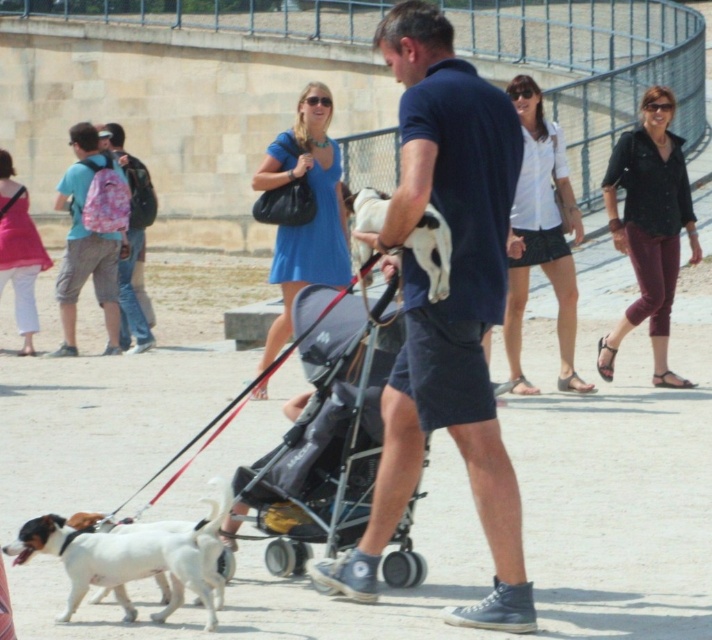
Question: Which object is closer to the camera taking this photo?

Choices:
 (A) dark blue cotton polo shirt at center
 (B) pink backpack at left
 (C) white fur dog at lower left

Answer: (A)

Question: Which point appears farthest from the camera in this image?

Choices:
 (A) (127, 333)
 (B) (325, 371)
 (C) (498, 477)

Answer: (A)

Question: Can you confirm if black fabric stroller at center is positioned to the left of white and black fur at center?

Choices:
 (A) yes
 (B) no

Answer: (A)

Question: Which object is farther from the camera taking this photo?

Choices:
 (A) white fur dog at lower left
 (B) pink fabric backpack at left
 (C) dark blue cotton polo shirt at center
 (D) white and black fur at center

Answer: (B)

Question: Does dark blue cotton polo shirt at center appear on the left side of white and black fur at center?

Choices:
 (A) no
 (B) yes

Answer: (A)

Question: Does black fabric stroller at center have a lesser width compared to white and black fur at center?

Choices:
 (A) no
 (B) yes

Answer: (A)